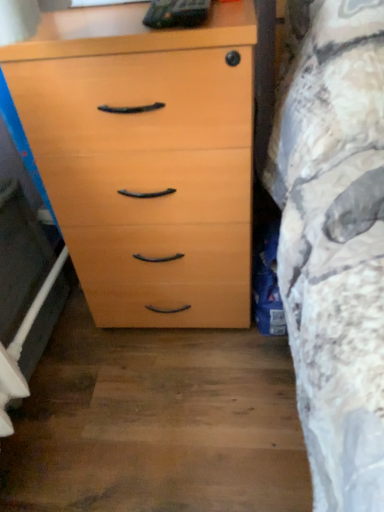
Where is `unoccupied area in front of light wood/finish chest of drawers at center`? This screenshot has height=512, width=384. unoccupied area in front of light wood/finish chest of drawers at center is located at coordinates (x=160, y=411).